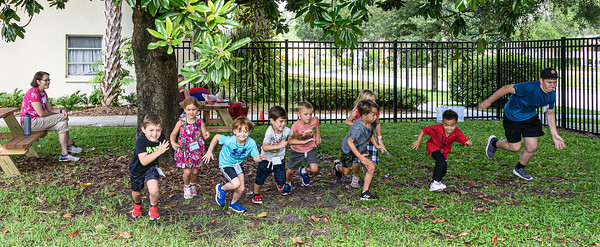
Locate an element on the screen. This screenshot has width=600, height=247. window is located at coordinates (87, 60).